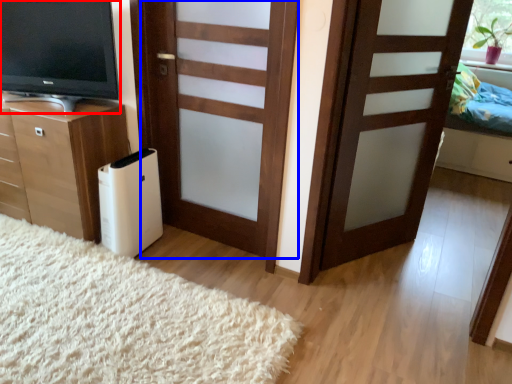
Question: Which object appears farthest to the camera in this image, television (highlighted by a red box) or door (highlighted by a blue box)?

Choices:
 (A) television
 (B) door

Answer: (A)